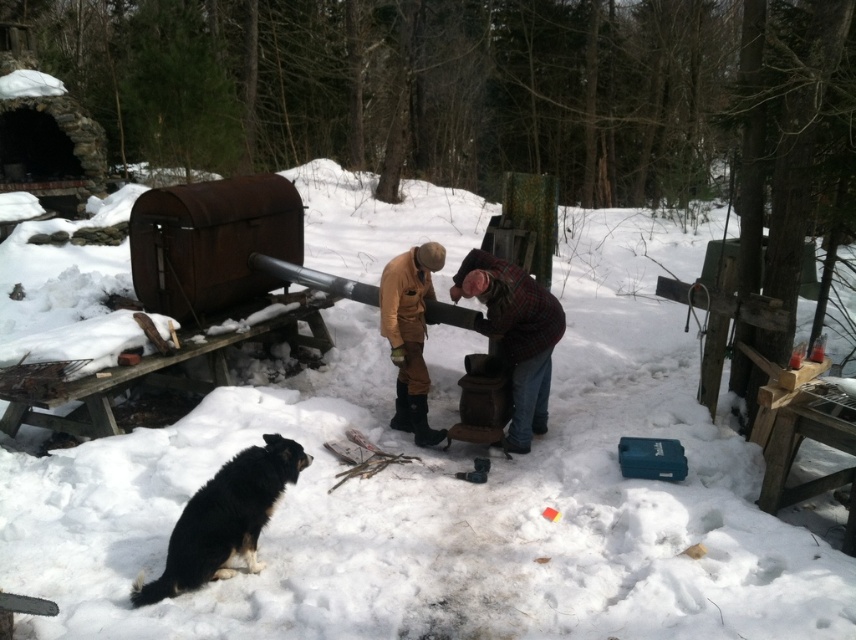
You are planning to take a photo of the plaid fabric shirt at center and the brown suede boots at center. Which object should you focus on first if you want to capture both in the same frame without moving the camera?

The plaid fabric shirt at center has a larger size compared to brown suede boots at center, so you should focus on the plaid fabric shirt at center first to ensure it is in focus and properly framed.

You are a hiker who just arrived at this snowy area and see the black fur dog at lower left and the brown suede boots at center. Which object is closer to you?

The black fur dog at lower left is closer to you because it has a smaller size compared to the brown suede boots at center.